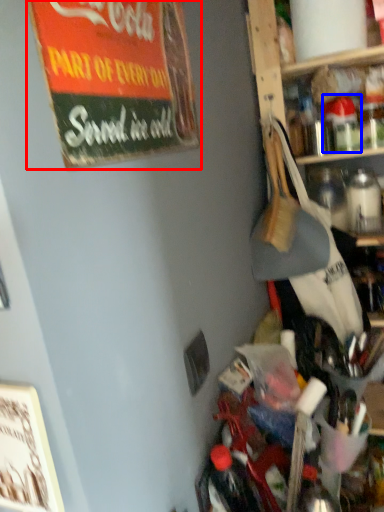
Question: Among these objects, which one is nearest to the camera, bulletin board (highlighted by a red box) or bottle (highlighted by a blue box)?

Choices:
 (A) bulletin board
 (B) bottle

Answer: (A)